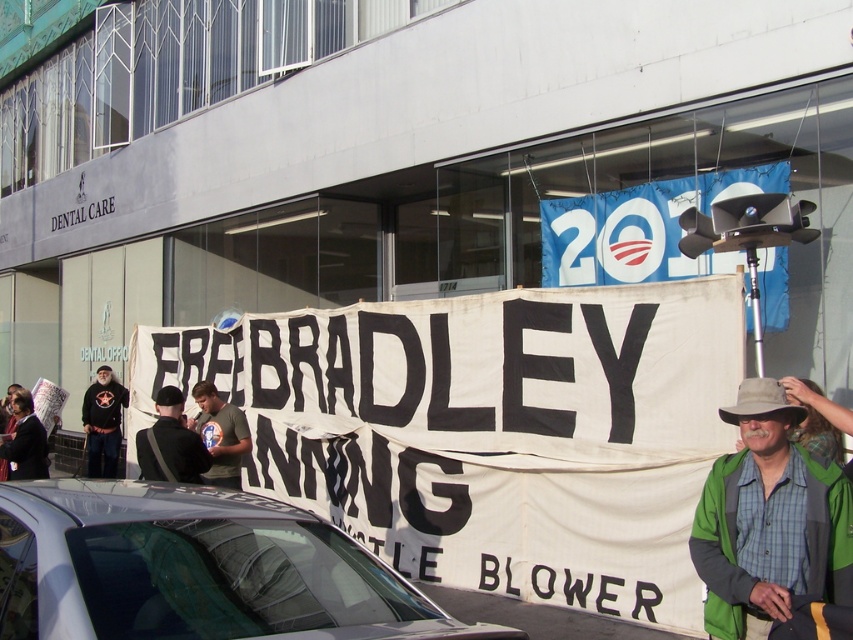
Question: Which object is positioned closest to the dark gray sweater at center?

Choices:
 (A) silver metallic car at lower center
 (B) green fabric jacket at lower right

Answer: (A)

Question: Can you confirm if green fabric jacket at lower right is thinner than dark gray sweater at center?

Choices:
 (A) yes
 (B) no

Answer: (A)

Question: Is silver metallic car at lower center positioned in front of dark gray sweater at center?

Choices:
 (A) no
 (B) yes

Answer: (B)

Question: Which object appears closest to the camera in this image?

Choices:
 (A) green fabric jacket at lower right
 (B) tan fabric cowboy hat at lower right
 (C) green t-shirt at center
 (D) dark gray sweater at center

Answer: (A)

Question: Considering the relative positions of green t-shirt at center and dark gray sweater at center in the image provided, where is green t-shirt at center located with respect to dark gray sweater at center?

Choices:
 (A) below
 (B) above

Answer: (B)

Question: Which object is the farthest from the dark gray fabric jacket at center?

Choices:
 (A) tan fabric cowboy hat at lower right
 (B) green t-shirt at center
 (C) dark gray sweater at center
 (D) green fabric jacket at lower right

Answer: (C)